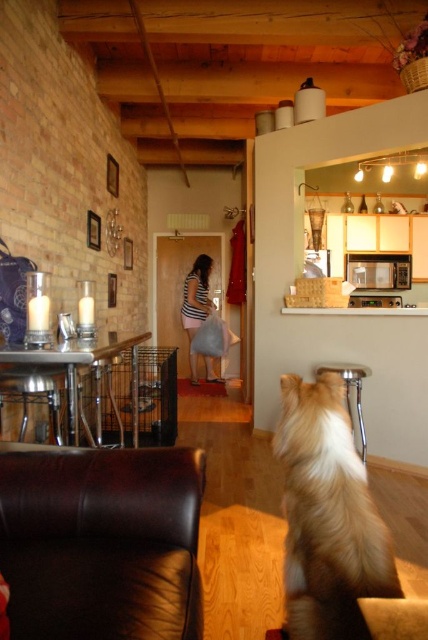
You are a guest entering the living room and see the fluffy golden dog at center and the metallic silver stool at lower center. Which object is closer to the entrance?

The fluffy golden dog at center is closer to the entrance because it is positioned on the left side of the metallic silver stool at lower center, implying it is nearer to the entrance area.

You are standing in the living room and want to take a photo of the two points mentioned. Which point, point (324,385) or point (341,362), will appear larger in your photo?

Point (324,385) is closer to the camera than point (341,362), so it will appear larger in the photo.